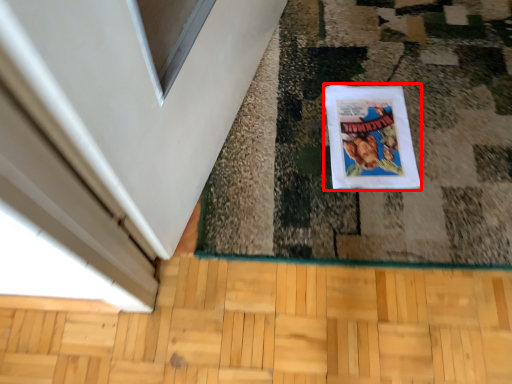
Question: From the image, what is the correct spatial relationship of comic book (annotated by the red box) in relation to hardwood?

Choices:
 (A) right
 (B) left

Answer: (A)